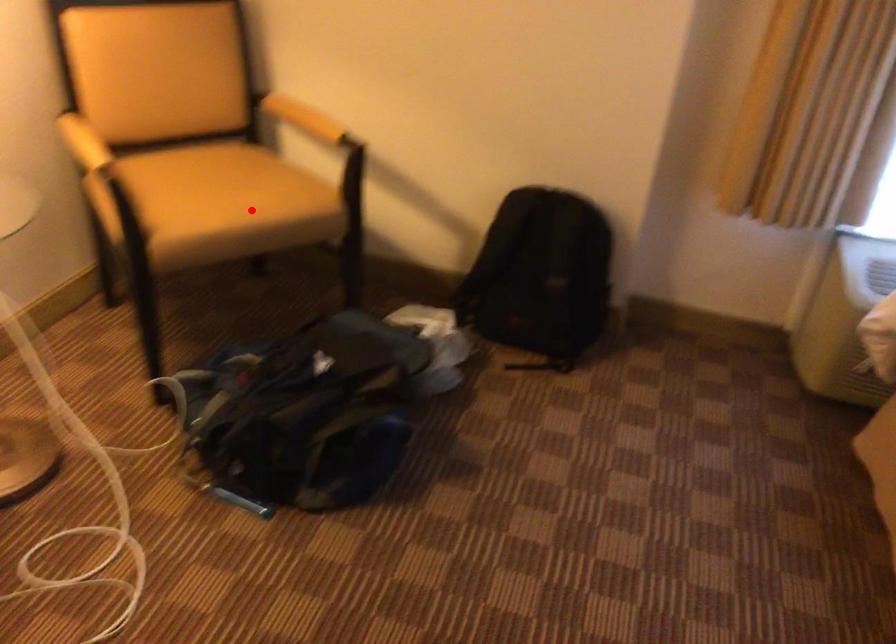
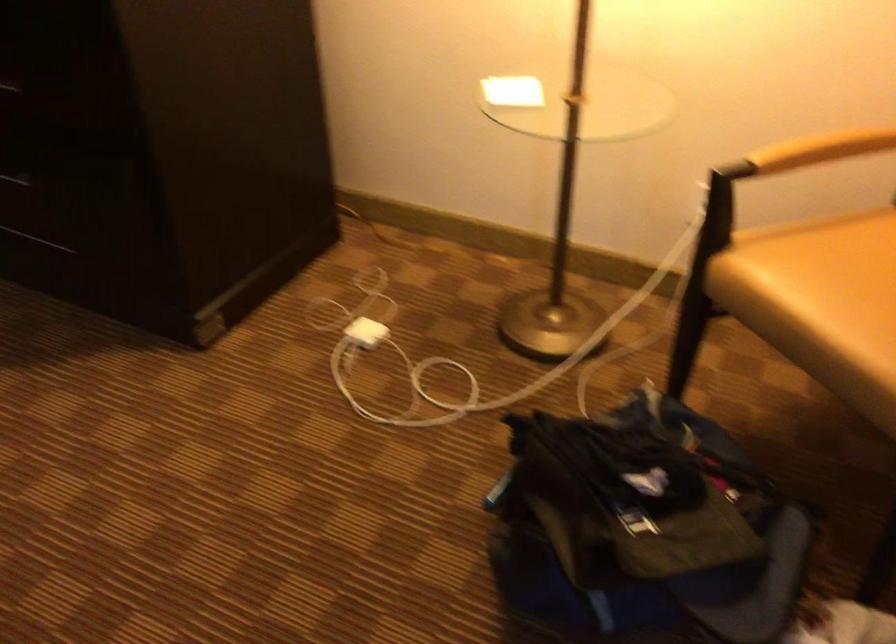
Question: A red point is marked in image1. In image2, is the corresponding 3D point closer to the camera or farther? Reply with the corresponding letter.

Choices:
 (A) The corresponding 3D point is closer.
 (B) The corresponding 3D point is farther.

Answer: (A)